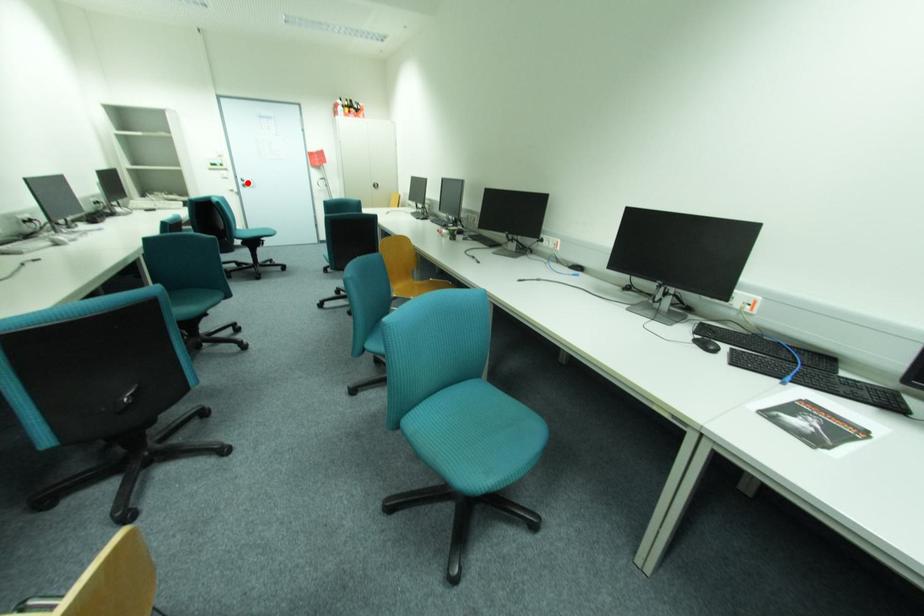
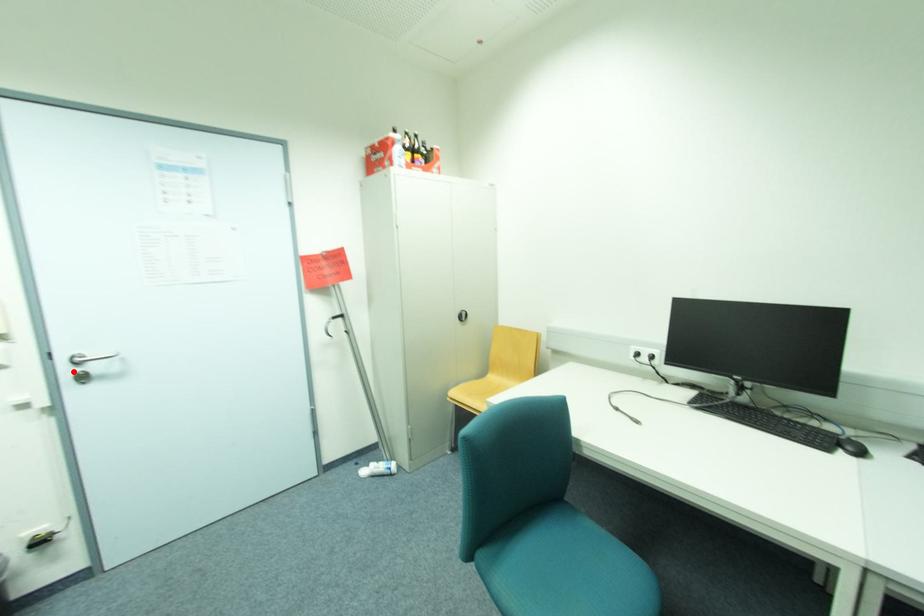
I am providing you with two images of the same scene from different viewpoints. A red point is marked on the first image and another point is marked on the second image. Is the marked point in image1 the same physical position as the marked point in image2?

Yes